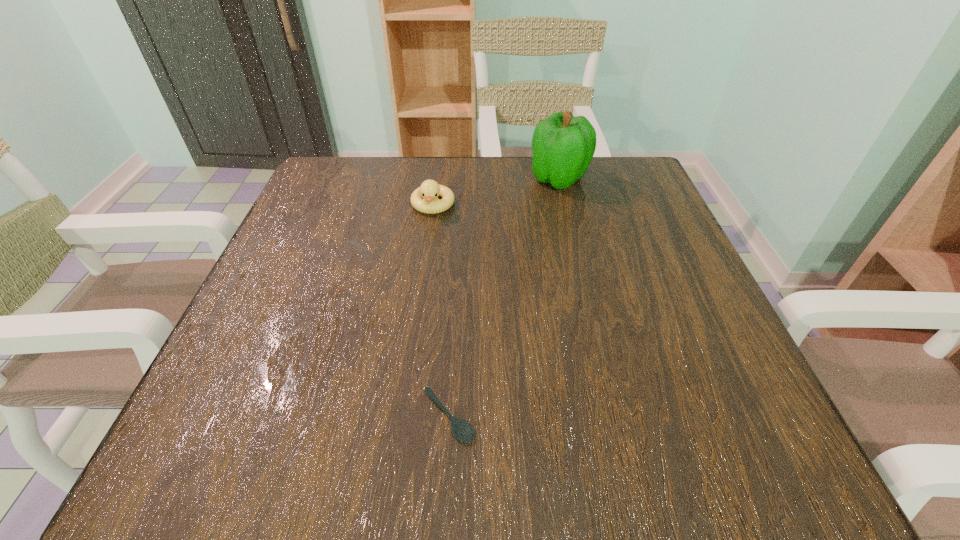
Locate an element on the screen. This screenshot has height=540, width=960. free space between the rightmost object and the nearest object is located at coordinates point(504,298).

Identify which object is the closest to the shortest object. Please provide its 2D coordinates. Your answer should be formatted as a tuple, i.e. [(x, y)], where the tuple contains the x and y coordinates of a point satisfying the conditions above.

[(424, 199)]

Identify the location of the second closest object to the rightmost object. The width and height of the screenshot is (960, 540). (462, 430).

Identify the location of free point that satisfies the following two spatial constraints: 1. at the beak of the second shortest object; 2. on the left side of the nearest object. (404, 416).

Locate an element on the screen. This screenshot has height=540, width=960. free location that satisfies the following two spatial constraints: 1. on the back side of the shortest object; 2. on the left side of the bell pepper is located at coordinates (462, 179).

At what (x,y) coordinates should I click in order to perform the action: click on vacant space that satisfies the following two spatial constraints: 1. at the beak of the second tallest object; 2. on the left side of the shortest object. Please return your answer as a coordinate pair (x, y). Looking at the image, I should click on (404, 416).

Where is `free space that satisfies the following two spatial constraints: 1. at the beak of the soupspoon; 2. on the left side of the duckling`? free space that satisfies the following two spatial constraints: 1. at the beak of the soupspoon; 2. on the left side of the duckling is located at coordinates (404, 416).